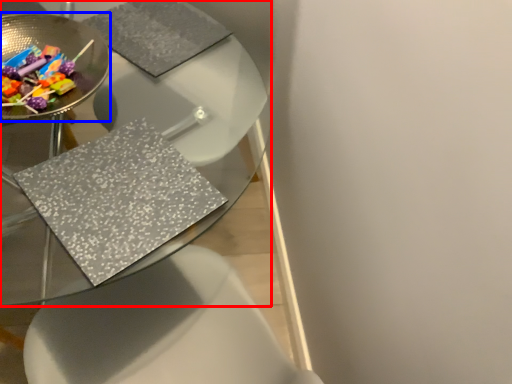
Question: Among these objects, which one is farthest to the camera, table (highlighted by a red box) or glass plate (highlighted by a blue box)?

Choices:
 (A) table
 (B) glass plate

Answer: (B)